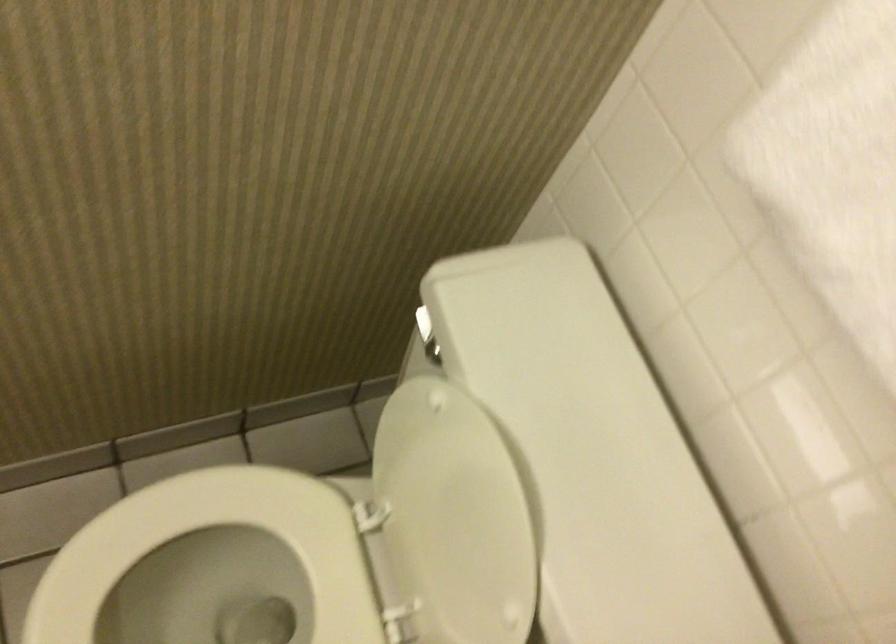
The height and width of the screenshot is (644, 896). Find the location of `white toilet lid`. white toilet lid is located at coordinates [453, 518].